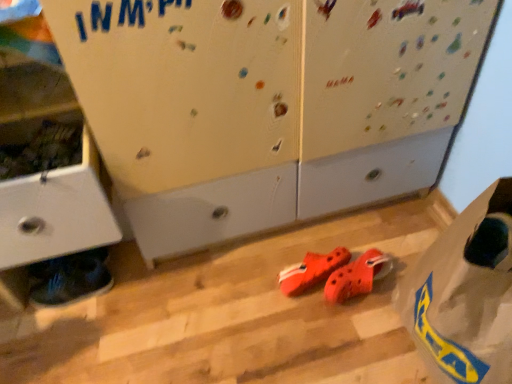
Where is `vacant space in front of matte white cabinet at left`? This screenshot has width=512, height=384. vacant space in front of matte white cabinet at left is located at coordinates (85, 342).